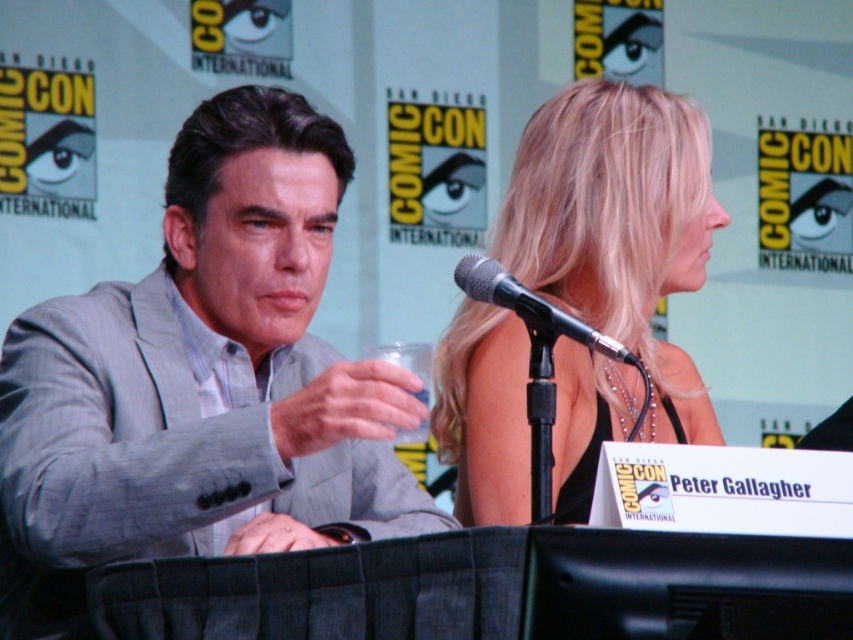
Locate an element on the screen. The width and height of the screenshot is (853, 640). blonde hair at center is located at coordinates (618, 227).

Who is shorter, blonde hair at center or black metallic microphone at upper center?

black metallic microphone at upper center

Is point (706, 179) farther from viewer compared to point (479, 259)?

That is True.

At what (x,y) coordinates should I click in order to perform the action: click on blonde hair at center. Please return your answer as a coordinate pair (x, y). Looking at the image, I should click on (618, 227).

Is gray pinstripe suit at left below black metallic microphone at upper center?

Yes.

Who is more forward, (282, 452) or (573, 324)?

Point (573, 324) is more forward.

The width and height of the screenshot is (853, 640). Describe the element at coordinates (202, 380) in the screenshot. I see `gray pinstripe suit at left` at that location.

I want to click on gray pinstripe suit at left, so click(x=202, y=380).

Does gray pinstripe suit at left appear on the right side of blonde hair at center?

No, gray pinstripe suit at left is not to the right of blonde hair at center.

Is gray pinstripe suit at left closer to the viewer compared to blonde hair at center?

Yes, it is in front of blonde hair at center.

Locate an element on the screen. The image size is (853, 640). gray pinstripe suit at left is located at coordinates (202, 380).

At what (x,y) coordinates should I click in order to perform the action: click on gray pinstripe suit at left. Please return your answer as a coordinate pair (x, y). This screenshot has width=853, height=640. Looking at the image, I should click on (202, 380).